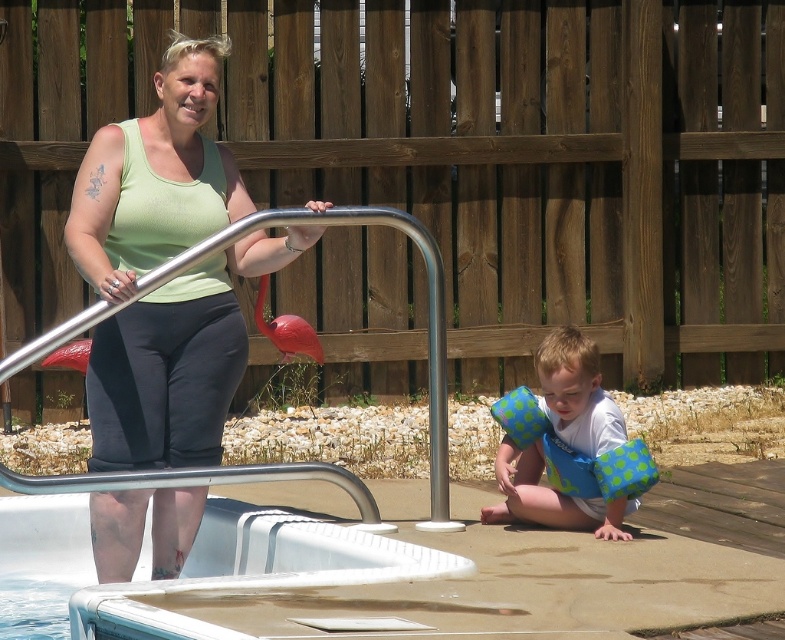
You are a photographer standing in the backyard pool area. You want to take a photo that includes both the silver metallic handrail at upper center and the white fabric shirt at lower right. Which object should you focus on first to ensure both are in clear view?

You should focus on the silver metallic handrail at upper center first because it is closer to the viewer than the white fabric shirt at lower right. By focusing on the closer object, the farther one will still be in focus due to the depth of field.